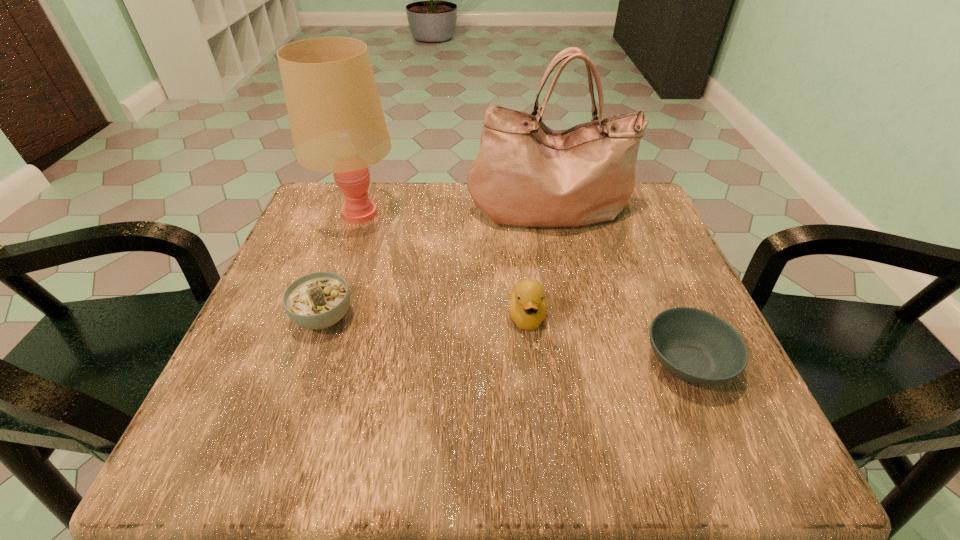
Find the location of `lampshade`. lampshade is located at coordinates (337, 122).

Find the location of `handbag`. handbag is located at coordinates (526, 174).

Where is `the third shortest object`? the third shortest object is located at coordinates (527, 305).

Where is `the left soup bowl`? the left soup bowl is located at coordinates (318, 300).

Where is `the taller soup bowl`? This screenshot has height=540, width=960. the taller soup bowl is located at coordinates (318, 300).

Locate an element on the screen. the shortest object is located at coordinates (696, 346).

This screenshot has height=540, width=960. I want to click on the right soup bowl, so click(696, 346).

Identify the location of vacant space located on the front of the lampshade. This screenshot has width=960, height=540. (329, 297).

Locate an element on the screen. free region located 0.380m at the front of the handbag with handles is located at coordinates (585, 383).

This screenshot has width=960, height=540. I want to click on free spot located 0.180m facing forward on the duckling, so click(x=540, y=436).